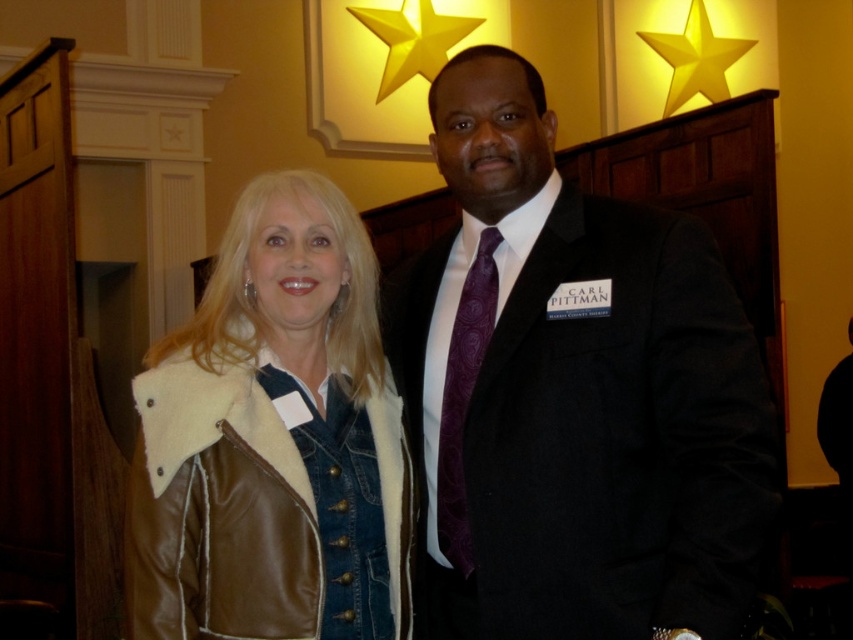
Question: Can you confirm if brown leather jacket at center is thinner than yellow paper star at upper center?

Choices:
 (A) no
 (B) yes

Answer: (B)

Question: Which point appears closest to the camera in this image?

Choices:
 (A) (459, 104)
 (B) (462, 500)
 (C) (706, 64)
 (D) (194, 420)

Answer: (D)

Question: Is matte black suit at center smaller than gold metallic star at upper center?

Choices:
 (A) no
 (B) yes

Answer: (A)

Question: Which point appears farthest from the camera in this image?

Choices:
 (A) (665, 387)
 (B) (476, 291)
 (C) (468, 17)

Answer: (C)

Question: Which object is closer to the camera taking this photo?

Choices:
 (A) purple satin tie at center
 (B) gold metallic star at upper center
 (C) yellow paper star at upper center
 (D) brown leather jacket at center

Answer: (D)

Question: Is matte black suit at center wider than purple satin tie at center?

Choices:
 (A) no
 (B) yes

Answer: (B)